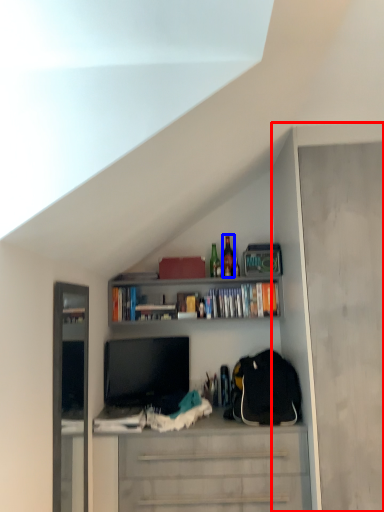
Question: Which object is further to the camera taking this photo, cabinet (highlighted by a red box) or bottle (highlighted by a blue box)?

Choices:
 (A) cabinet
 (B) bottle

Answer: (B)